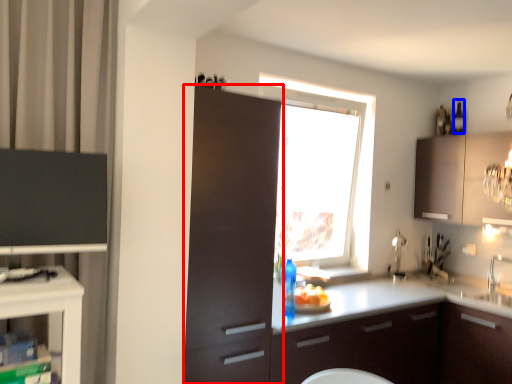
Question: Among these objects, which one is farthest to the camera, cabinetry (highlighted by a red box) or bottle (highlighted by a blue box)?

Choices:
 (A) cabinetry
 (B) bottle

Answer: (B)